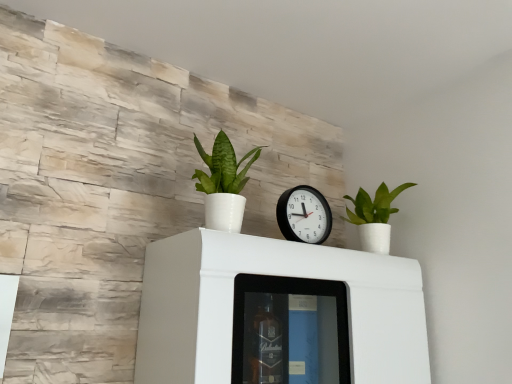
Question: Are white glossy cabinet at center and green glossy plant at center, acting as the 1th houseplant starting from the left, making contact?

Choices:
 (A) yes
 (B) no

Answer: (B)

Question: Does white glossy cabinet at center have a greater height compared to green glossy plant at center, acting as the 2th houseplant starting from the right?

Choices:
 (A) yes
 (B) no

Answer: (A)

Question: Is white glossy cabinet at center to the right of green glossy plant at center, the first houseplant viewed from the front, from the viewer's perspective?

Choices:
 (A) yes
 (B) no

Answer: (A)

Question: From a real-world perspective, is white glossy cabinet at center positioned under green glossy plant at center, the second houseplant in the back-to-front sequence, based on gravity?

Choices:
 (A) yes
 (B) no

Answer: (A)

Question: Is white glossy cabinet at center turned away from green glossy plant at center, the second houseplant in the back-to-front sequence?

Choices:
 (A) yes
 (B) no

Answer: (B)

Question: From a real-world perspective, is white glossy cabinet at center over green glossy plant at center, the first houseplant viewed from the front?

Choices:
 (A) yes
 (B) no

Answer: (B)

Question: Does black plastic wall clock at center have a greater width compared to green matte plant at upper right, which is the 2th houseplant from front to back?

Choices:
 (A) yes
 (B) no

Answer: (B)

Question: Is black plastic wall clock at center behind green matte plant at upper right, which is the first houseplant in right-to-left order?

Choices:
 (A) yes
 (B) no

Answer: (B)

Question: Is black plastic wall clock at center positioned far away from green matte plant at upper right, which is the 2th houseplant from front to back?

Choices:
 (A) yes
 (B) no

Answer: (B)

Question: Is black plastic wall clock at center turned away from green matte plant at upper right, which is counted as the second houseplant, starting from the left?

Choices:
 (A) yes
 (B) no

Answer: (B)

Question: Is black plastic wall clock at center in front of green matte plant at upper right, the first houseplant from the back?

Choices:
 (A) no
 (B) yes

Answer: (B)

Question: From the image's perspective, is black plastic wall clock at center located beneath green matte plant at upper right, the first houseplant from the back?

Choices:
 (A) no
 (B) yes

Answer: (A)

Question: Is white glossy cabinet at center shorter than green matte plant at upper right, which is the first houseplant in right-to-left order?

Choices:
 (A) no
 (B) yes

Answer: (A)